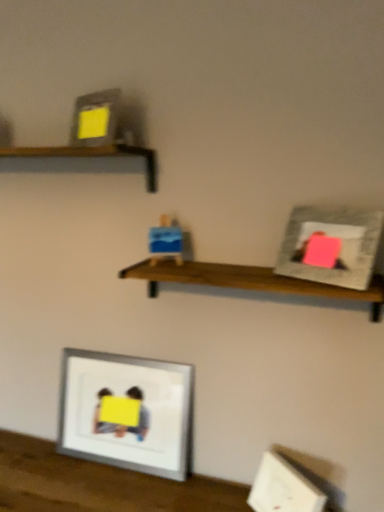
I want to click on vacant area situated below wooden shelf at upper left, which appears as the 1th shelf when viewed from the left (from a real-world perspective), so click(66, 460).